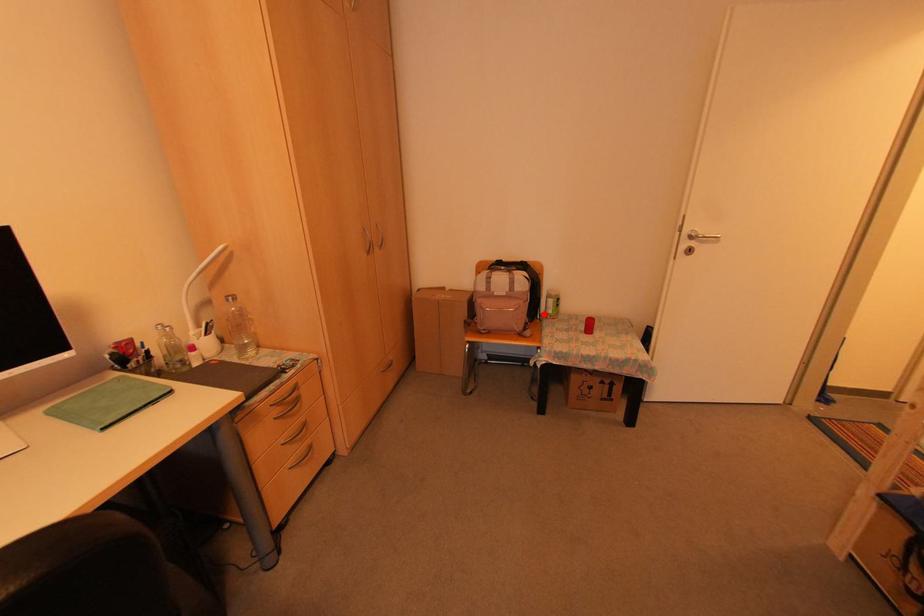
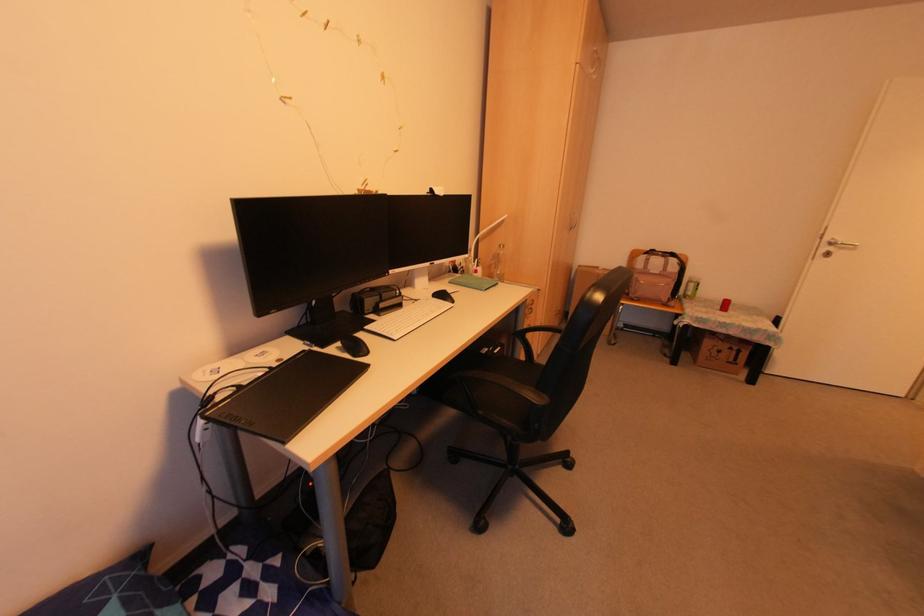
Question: I am providing you with two images of the same scene from different viewpoints. Image1 has a red point marked. In image2, the corresponding 3D location appears at what relative position? Reply with the corresponding letter.

Choices:
 (A) Closer
 (B) Farther

Answer: (A)